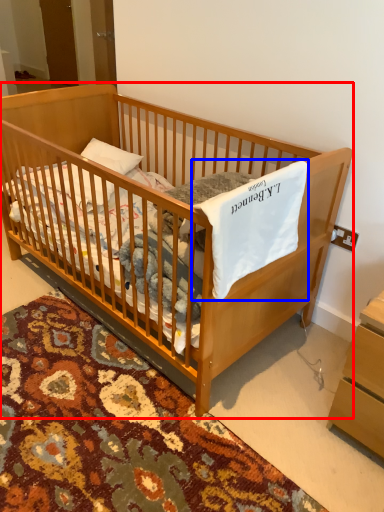
Question: Which of the following is the farthest to the observer, infant bed (highlighted by a red box) or sheet (highlighted by a blue box)?

Choices:
 (A) infant bed
 (B) sheet

Answer: (A)